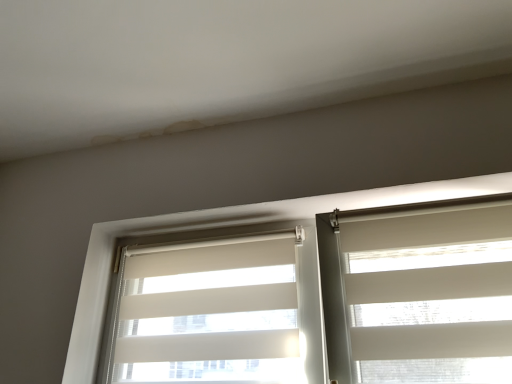
Question: Should I look upward or downward to see white fabric window blind at right, the second window blind when ordered from left to right?

Choices:
 (A) up
 (B) down

Answer: (B)

Question: From the image's perspective, would you say white fabric window blind at right, the second window blind when ordered from left to right, is shown under white fabric window blind at left, the second window blind viewed from the right?

Choices:
 (A) no
 (B) yes

Answer: (A)

Question: Is white fabric window blind at right, the second window blind when ordered from left to right, oriented towards white fabric window blind at left, placed as the 1th window blind when sorted from left to right?

Choices:
 (A) yes
 (B) no

Answer: (B)

Question: Is white fabric window blind at right, the first window blind viewed from the right, behind white fabric window blind at left, placed as the 1th window blind when sorted from left to right?

Choices:
 (A) yes
 (B) no

Answer: (B)

Question: From a real-world perspective, does white fabric window blind at right, the second window blind when ordered from left to right, sit lower than white fabric window blind at left, placed as the 1th window blind when sorted from left to right?

Choices:
 (A) yes
 (B) no

Answer: (A)

Question: Is white fabric window blind at right, the second window blind when ordered from left to right, thinner than white fabric window blind at left, the second window blind viewed from the right?

Choices:
 (A) no
 (B) yes

Answer: (A)

Question: Is white fabric window blind at right, the first window blind viewed from the right, located outside white fabric window blind at left, placed as the 1th window blind when sorted from left to right?

Choices:
 (A) yes
 (B) no

Answer: (A)

Question: From the image's perspective, would you say white fabric blinds at center is shown under white fabric window blind at left, the second window blind viewed from the right?

Choices:
 (A) yes
 (B) no

Answer: (B)

Question: Does white fabric blinds at center appear on the right side of white fabric window blind at left, placed as the 1th window blind when sorted from left to right?

Choices:
 (A) yes
 (B) no

Answer: (A)

Question: Could you tell me if white fabric blinds at center is turned towards white fabric window blind at left, placed as the 1th window blind when sorted from left to right?

Choices:
 (A) yes
 (B) no

Answer: (A)

Question: Can you confirm if white fabric blinds at center is shorter than white fabric window blind at left, the second window blind viewed from the right?

Choices:
 (A) no
 (B) yes

Answer: (A)

Question: Is the surface of white fabric blinds at center in direct contact with white fabric window blind at left, the second window blind viewed from the right?

Choices:
 (A) no
 (B) yes

Answer: (A)

Question: Can you confirm if white fabric blinds at center is bigger than white fabric window blind at left, the second window blind viewed from the right?

Choices:
 (A) no
 (B) yes

Answer: (B)

Question: Does white fabric window blind at left, placed as the 1th window blind when sorted from left to right, have a greater height compared to white fabric window blind at right, the first window blind viewed from the right?

Choices:
 (A) yes
 (B) no

Answer: (A)